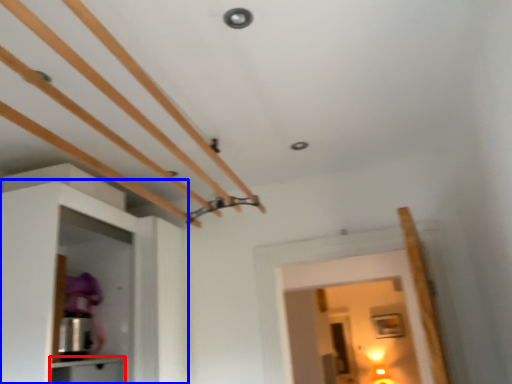
Question: Among these objects, which one is nearest to the camera, cabinetry (highlighted by a red box) or cabinetry (highlighted by a blue box)?

Choices:
 (A) cabinetry
 (B) cabinetry

Answer: (B)